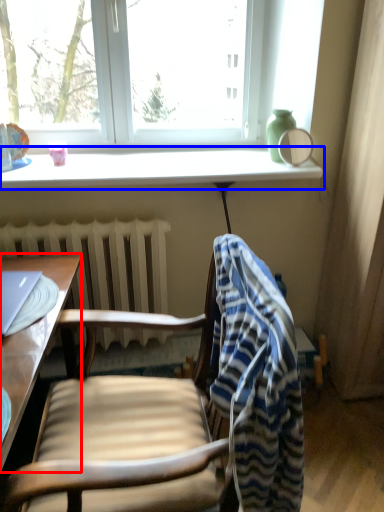
Question: Among these objects, which one is farthest to the camera, desk (highlighted by a red box) or window sill (highlighted by a blue box)?

Choices:
 (A) desk
 (B) window sill

Answer: (B)